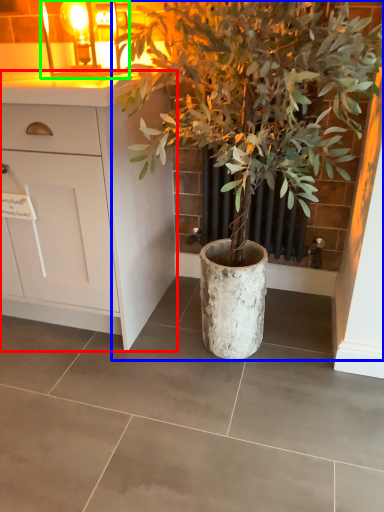
Question: Considering the real-world distances, which object is farthest from cabinetry (highlighted by a red box)? houseplant (highlighted by a blue box) or light fixture (highlighted by a green box)?

Choices:
 (A) houseplant
 (B) light fixture

Answer: (B)